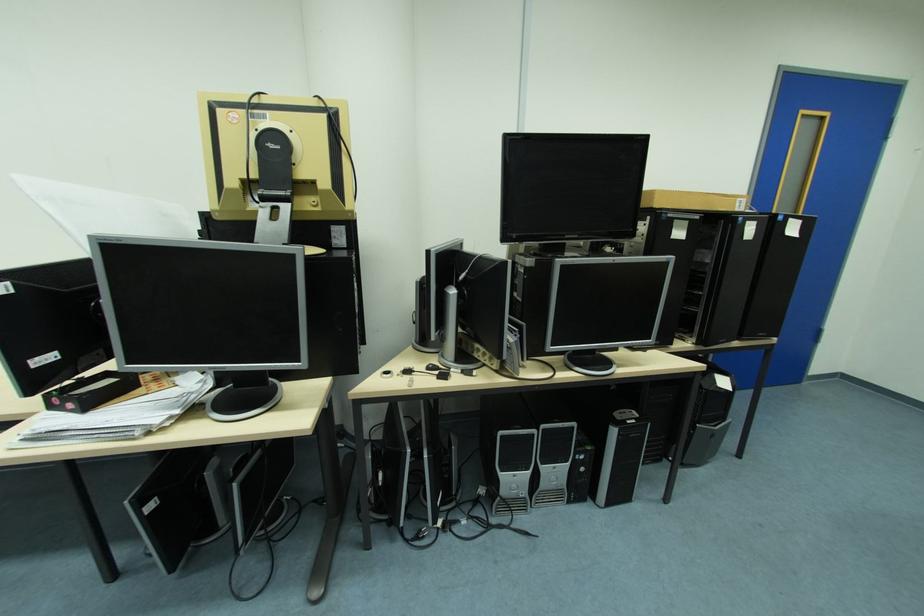
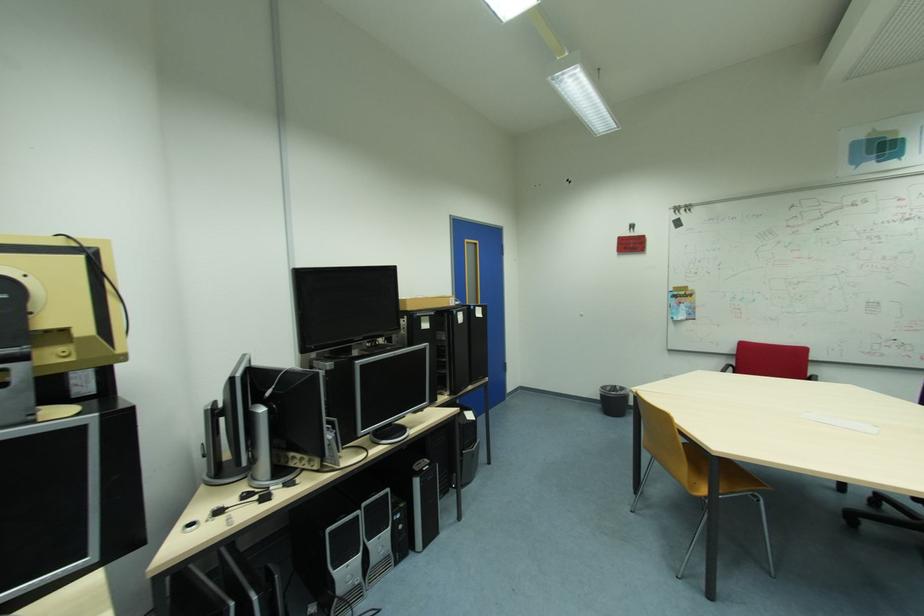
The point at (541, 436) is marked in the first image. Where is the corresponding point in the second image?

(365, 517)